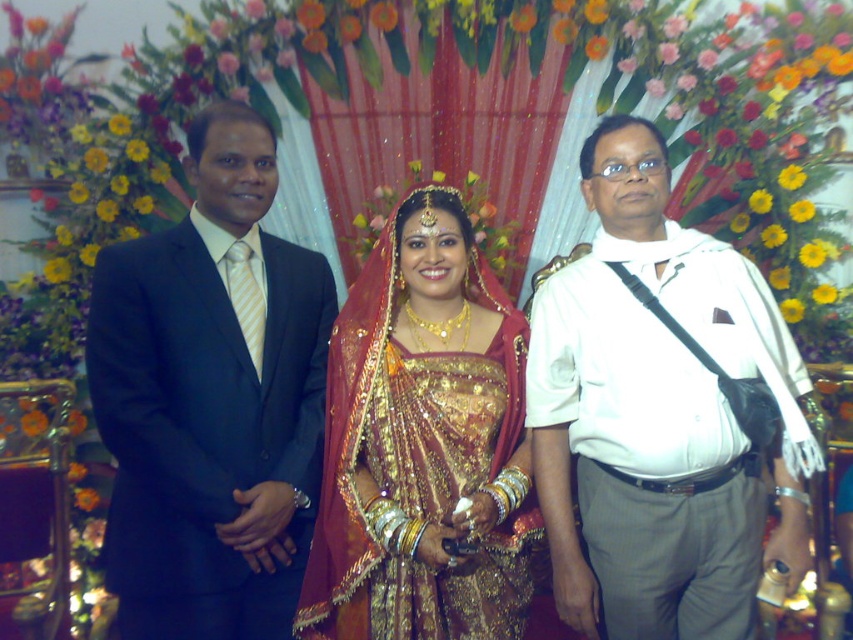
Can you confirm if white glossy shirt at right is thinner than gold sequined saree at center?

Incorrect, white glossy shirt at right's width is not less than gold sequined saree at center's.

Does white glossy shirt at right appear on the left side of gold sequined saree at center?

Incorrect, white glossy shirt at right is not on the left side of gold sequined saree at center.

Which is in front, point (733, 532) or point (416, 355)?

Positioned in front is point (733, 532).

Find the location of a particular element. This screenshot has height=640, width=853. white glossy shirt at right is located at coordinates (659, 416).

Between gold sequined dress at center and white glossy shirt at right, which one appears on the right side from the viewer's perspective?

From the viewer's perspective, white glossy shirt at right appears more on the right side.

Can you confirm if gold sequined dress at center is positioned above white glossy shirt at right?

Actually, gold sequined dress at center is below white glossy shirt at right.

What do you see at coordinates (496, 468) in the screenshot? I see `gold sequined dress at center` at bounding box center [496, 468].

Where is `gold sequined dress at center`? The height and width of the screenshot is (640, 853). gold sequined dress at center is located at coordinates (496, 468).

Can you confirm if gold sequined dress at center is positioned to the right of gold sequined saree at center?

Yes, gold sequined dress at center is to the right of gold sequined saree at center.

Does gold sequined dress at center appear under gold sequined saree at center?

No, gold sequined dress at center is not below gold sequined saree at center.

Is point (376, 500) positioned after point (521, 547)?

No, it is in front of (521, 547).

Identify the location of gold sequined dress at center. (496, 468).